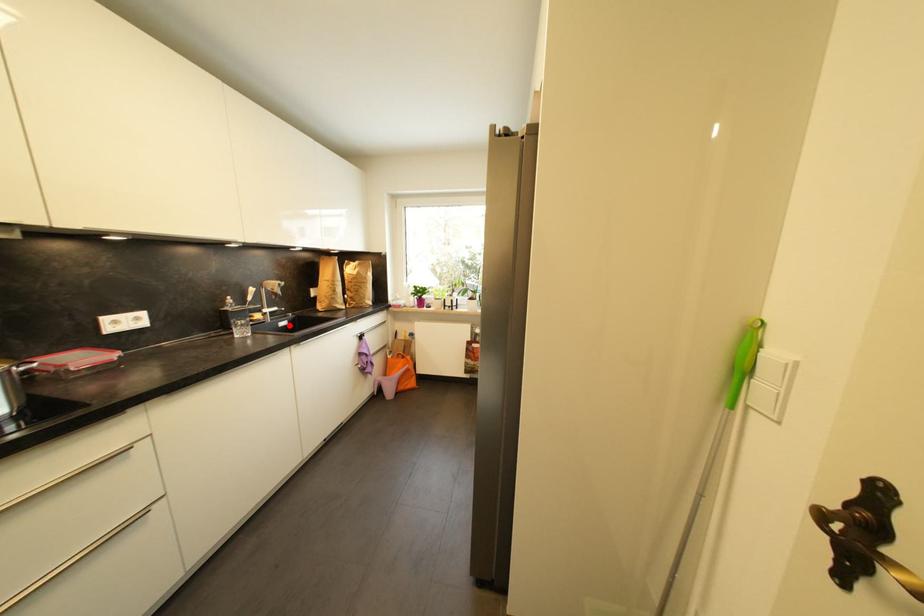
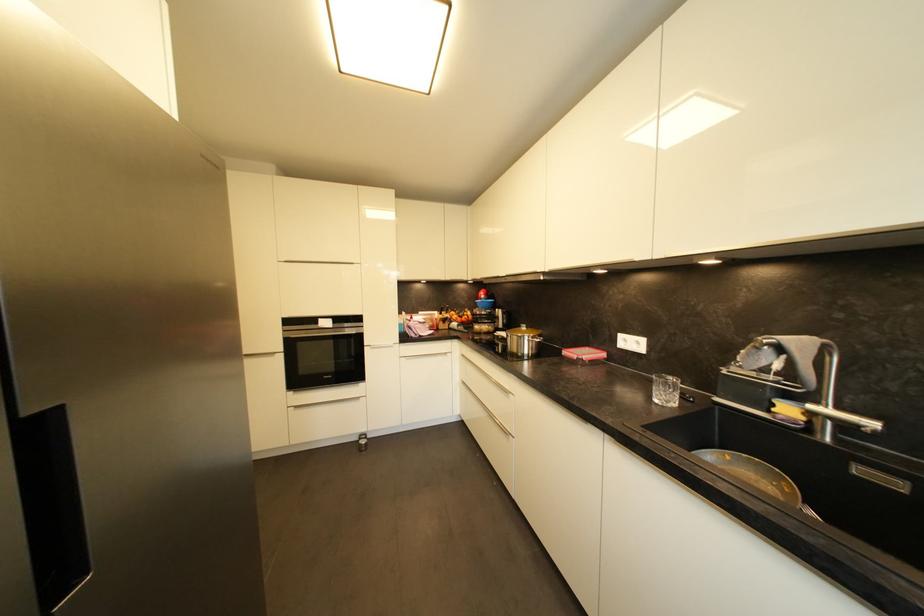
The point at the highlighted location is marked in the first image. Where is the corresponding point in the second image?

(904, 487)